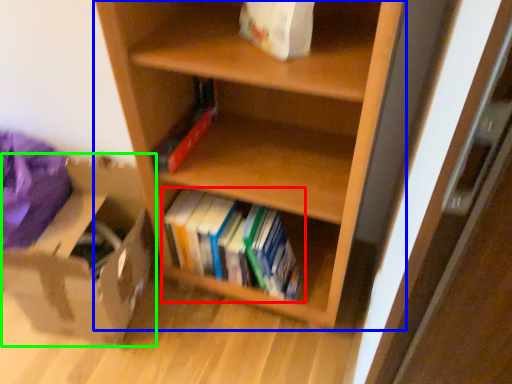
Question: Considering the real-world distances, which object is farthest from book (highlighted by a red box)? shelf (highlighted by a blue box) or cardboard box (highlighted by a green box)?

Choices:
 (A) shelf
 (B) cardboard box

Answer: (B)